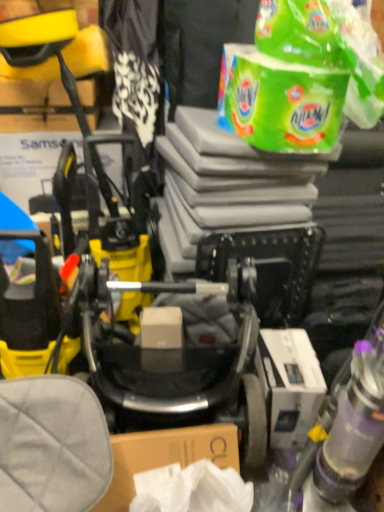
The width and height of the screenshot is (384, 512). Identify the location of green plastic detergent at upper right. (302, 77).

What is the approximate width of green plastic detergent at upper right?

It is 36.32 centimeters.

What do you see at coordinates (302, 77) in the screenshot? I see `green plastic detergent at upper right` at bounding box center [302, 77].

Identify the location of green plastic detergent at upper right. (302, 77).